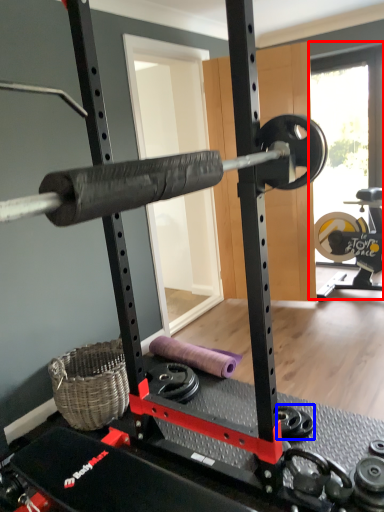
Question: Among these objects, which one is nearest to the camera, window screen (highlighted by a red box) or dumbbell (highlighted by a blue box)?

Choices:
 (A) window screen
 (B) dumbbell

Answer: (B)